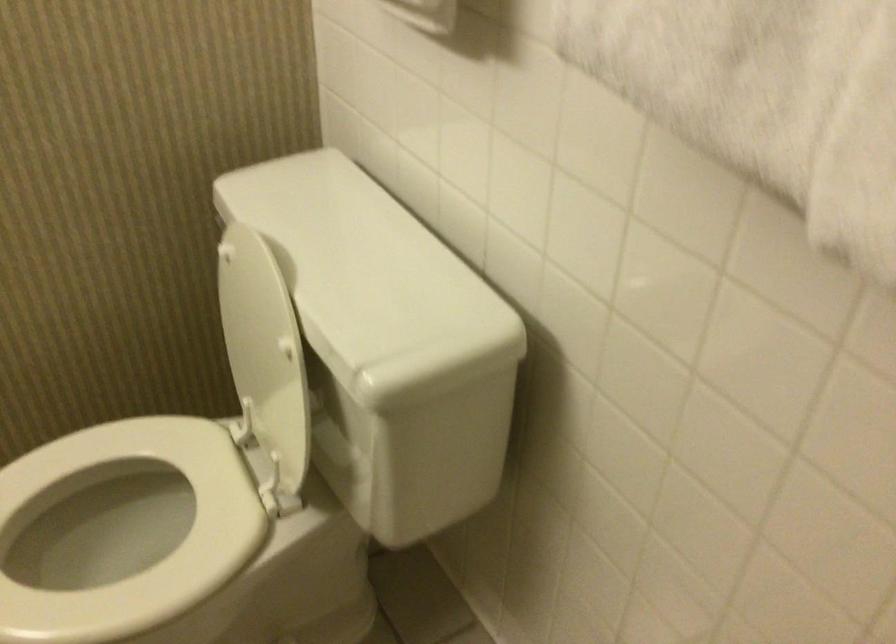
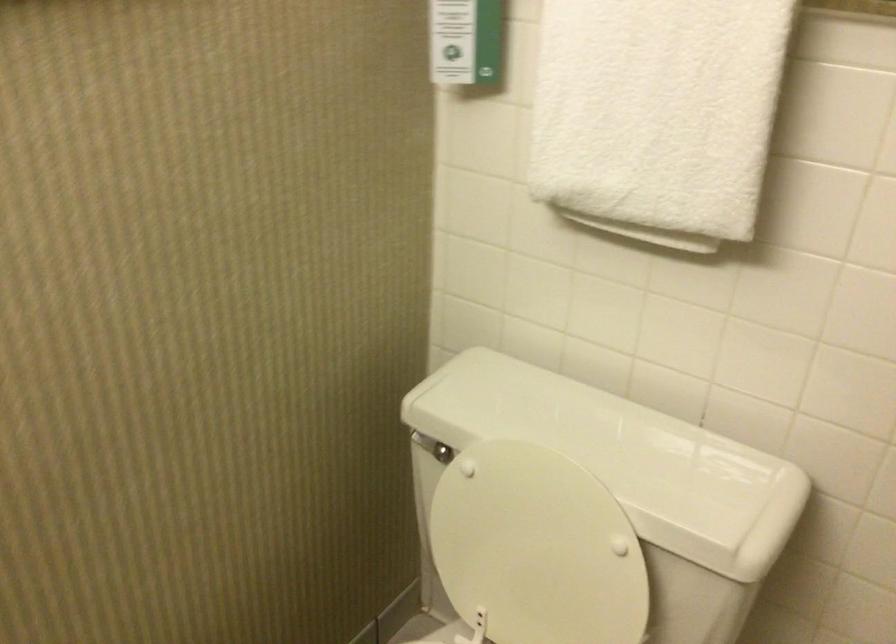
Where in the second image is the point corresponding to pixel 259 341 from the first image?

(536, 547)